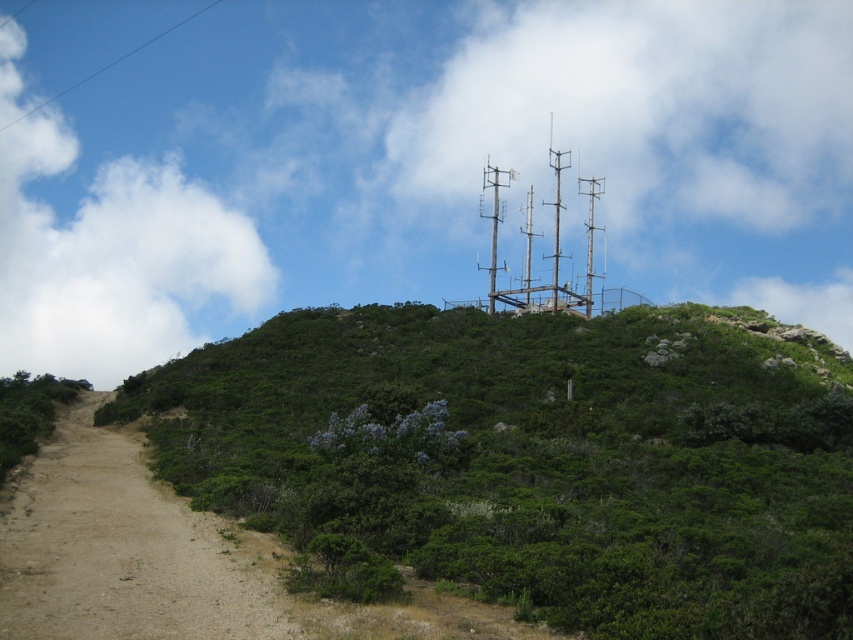
Does point (712, 168) lie behind point (558, 188)?

Yes, point (712, 168) is behind point (558, 188).

Can you confirm if white fluffy cloud at upper center is smaller than metallic gray antenna at upper center?

Incorrect, white fluffy cloud at upper center is not smaller in size than metallic gray antenna at upper center.

Does point (262, 129) come in front of point (556, 177)?

No, it is behind (556, 177).

Locate an element on the screen. This screenshot has height=640, width=853. white fluffy cloud at upper center is located at coordinates (405, 161).

Does white fluffy cloud at upper center have a greater height compared to wooden poles at upper center?

Yes.

Who is more distant from viewer, (712, 72) or (521, 292)?

Positioned behind is point (712, 72).

The image size is (853, 640). I want to click on white fluffy cloud at upper center, so click(405, 161).

Is brown dirt path at lower left wider than wooden poles at upper center?

Yes.

Can you confirm if brown dirt path at lower left is positioned above wooden poles at upper center?

No.

Which is in front, point (96, 456) or point (534, 310)?

Point (96, 456) is in front.

The width and height of the screenshot is (853, 640). What are the coordinates of `brown dirt path at lower left` in the screenshot? It's located at (120, 550).